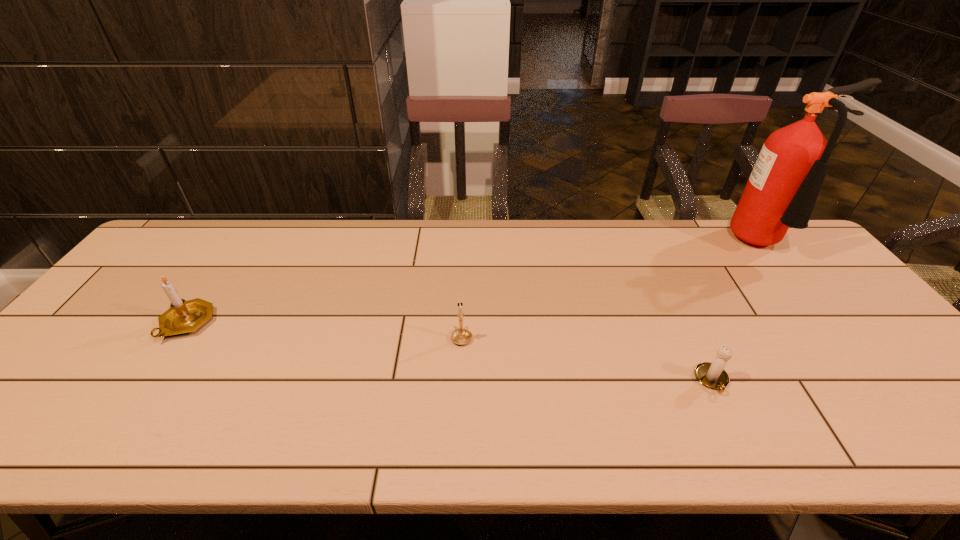
Locate an element on the screen. free space between the leftmost candle holder and the tallest object is located at coordinates (477, 284).

This screenshot has width=960, height=540. Find the location of `vacant area that lies between the nearest candle holder and the second candle holder from left to right`. vacant area that lies between the nearest candle holder and the second candle holder from left to right is located at coordinates pyautogui.click(x=587, y=359).

Where is `the third closest object to the third shortest object`? the third closest object to the third shortest object is located at coordinates pos(781,192).

I want to click on object that stands as the second closest to the farthest object, so click(461, 336).

What are the coordinates of `candle holder object that ranks as the second closest to the rightmost candle holder` in the screenshot? It's located at (184, 316).

Where is `the second closest candle holder to the second object from left to right`? the second closest candle holder to the second object from left to right is located at coordinates (184, 316).